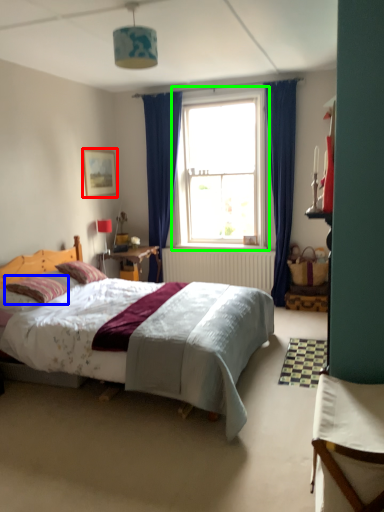
Question: Considering the real-world distances, which object is closest to picture frame (highlighted by a red box)? pillow (highlighted by a blue box) or window (highlighted by a green box).

Choices:
 (A) pillow
 (B) window

Answer: (B)